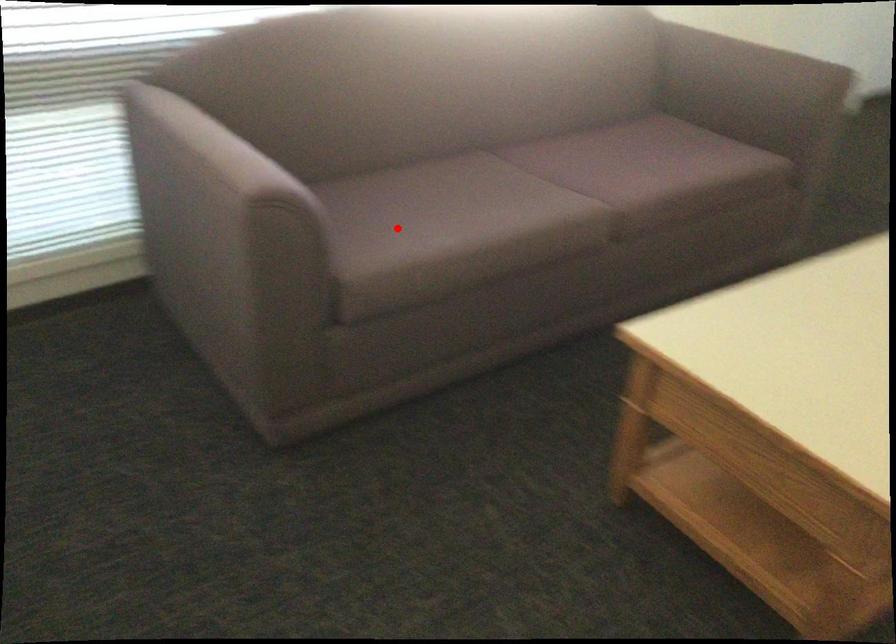
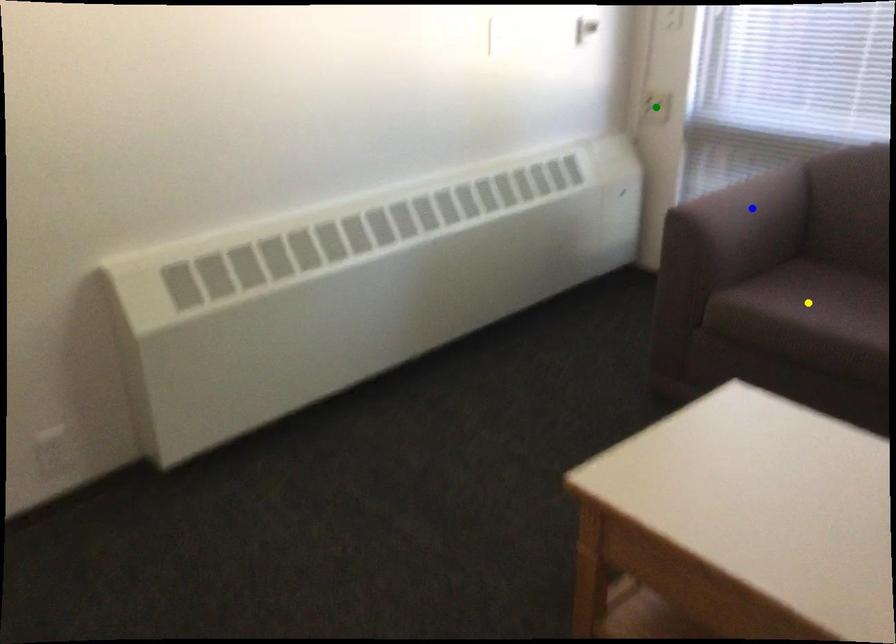
Question: I am providing you with two images of the same scene from different viewpoints. A red point is marked on the first image. You are given multiple points on the second image. Which mark in image 2 goes with the point in image 1?

Choices:
 (A) blue point
 (B) yellow point
 (C) green point

Answer: (B)